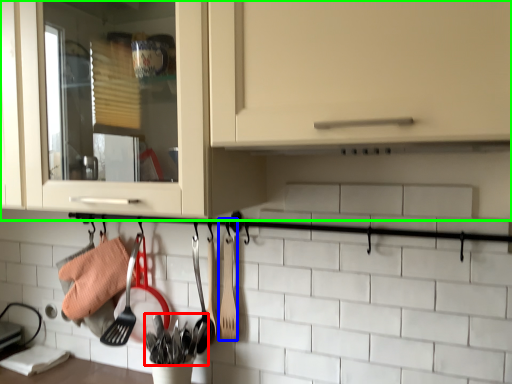
Question: Estimate the real-world distances between objects in this image. Which object is farther from silverware (highlighted by a red box), spatula (highlighted by a blue box) or cabinetry (highlighted by a green box)?

Choices:
 (A) spatula
 (B) cabinetry

Answer: (B)